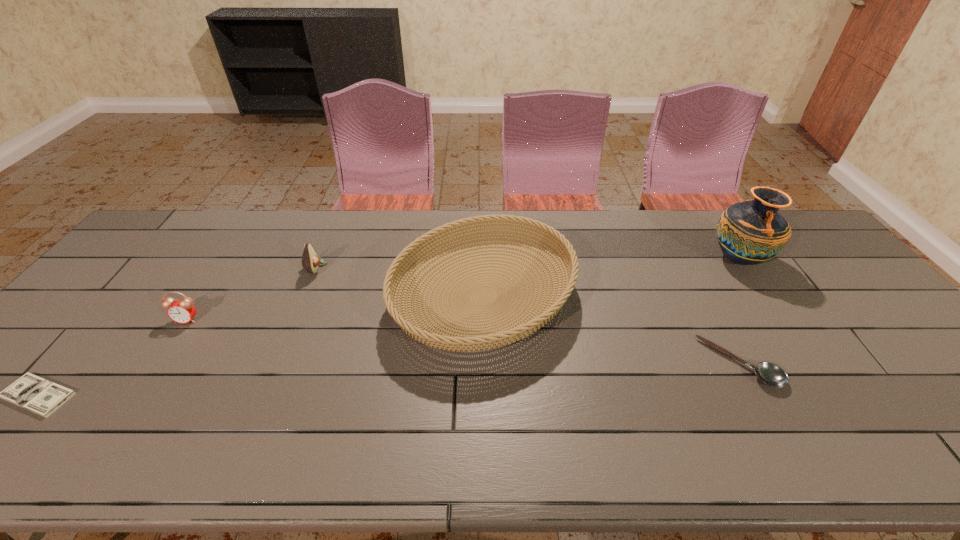
In order to click on empty space between the pottery and the fifth tallest object in this screenshot , I will do `click(739, 311)`.

Choose which object is the fifth nearest neighbor to the avocado. Please provide its 2D coordinates. Your answer should be formatted as a tuple, i.e. [(x, y)], where the tuple contains the x and y coordinates of a point satisfying the conditions above.

[(751, 232)]

Identify which object is located as the fifth nearest to the third object from right to left. Please provide its 2D coordinates. Your answer should be formatted as a tuple, i.e. [(x, y)], where the tuple contains the x and y coordinates of a point satisfying the conditions above.

[(31, 392)]

At what (x,y) coordinates should I click in order to perform the action: click on free space that satisfies the following two spatial constraints: 1. on the back side of the basket; 2. on the seed side of the third object from left to right. Please return your answer as a coordinate pair (x, y). Looking at the image, I should click on (483, 268).